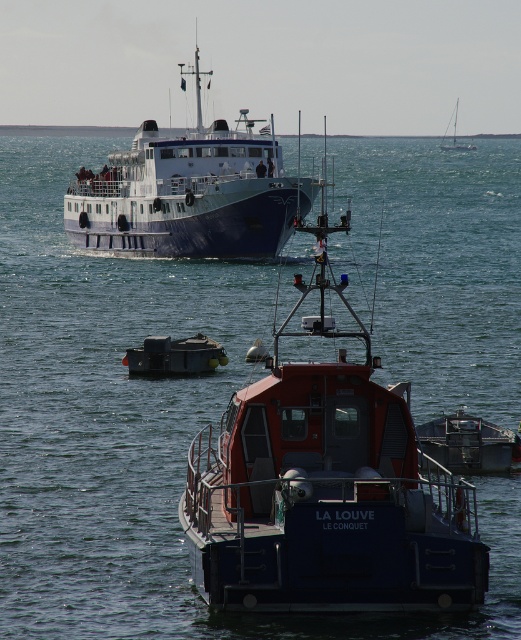
Question: Which is farther from the white glossy sailboat at upper right?

Choices:
 (A) metallic gray buoy at center
 (B) blue matte ship at center

Answer: (A)

Question: Does blue matte ship at center have a smaller size compared to white glossy sailboat at upper right?

Choices:
 (A) no
 (B) yes

Answer: (A)

Question: Does metallic gray buoy at center have a smaller size compared to white glossy sailboat at upper right?

Choices:
 (A) no
 (B) yes

Answer: (B)

Question: Which object appears farthest from the camera in this image?

Choices:
 (A) white glossy sailboat at upper right
 (B) metallic gray buoy at center
 (C) blue matte ship at center

Answer: (A)

Question: Is blue matte ship at center below white glossy sailboat at upper right?

Choices:
 (A) no
 (B) yes

Answer: (B)

Question: Which point appears farthest from the camera in this image?

Choices:
 (A) (254, 177)
 (B) (460, 147)
 (C) (179, 353)

Answer: (B)